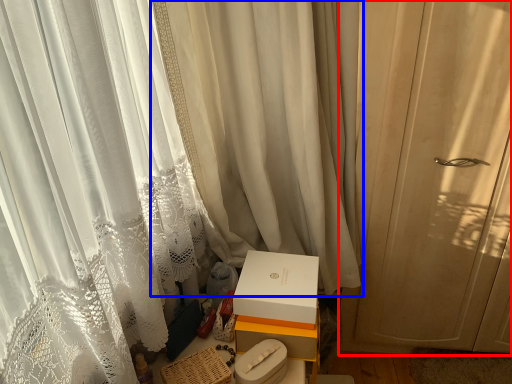
Question: Which point is closer to the camera, curtain (highlighted by a red box) or curtain (highlighted by a blue box)?

Choices:
 (A) curtain
 (B) curtain

Answer: (B)